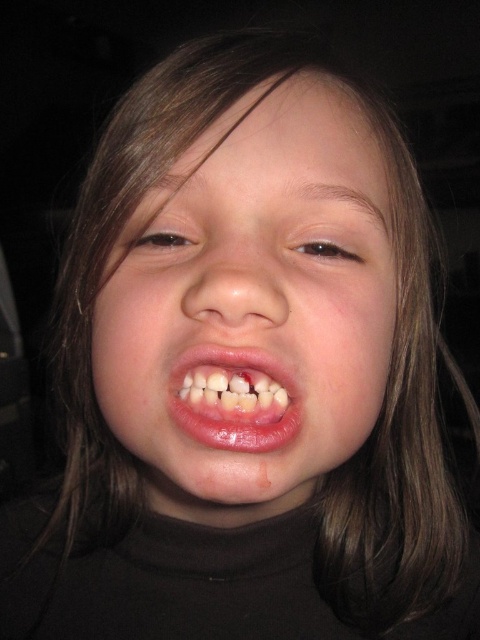
Question: Can you confirm if smooth skin face at center is positioned to the left of pink glossy lips at center?

Choices:
 (A) yes
 (B) no

Answer: (B)

Question: Is smooth skin face at center to the right of pink glossy lips at center from the viewer's perspective?

Choices:
 (A) no
 (B) yes

Answer: (B)

Question: Which of the following is the farthest from the observer?

Choices:
 (A) (283, 385)
 (B) (247, 481)

Answer: (A)

Question: Is smooth skin face at center wider than pink glossy lips at center?

Choices:
 (A) no
 (B) yes

Answer: (B)

Question: Which object appears farthest from the camera in this image?

Choices:
 (A) pink glossy lips at center
 (B) smooth skin face at center

Answer: (A)